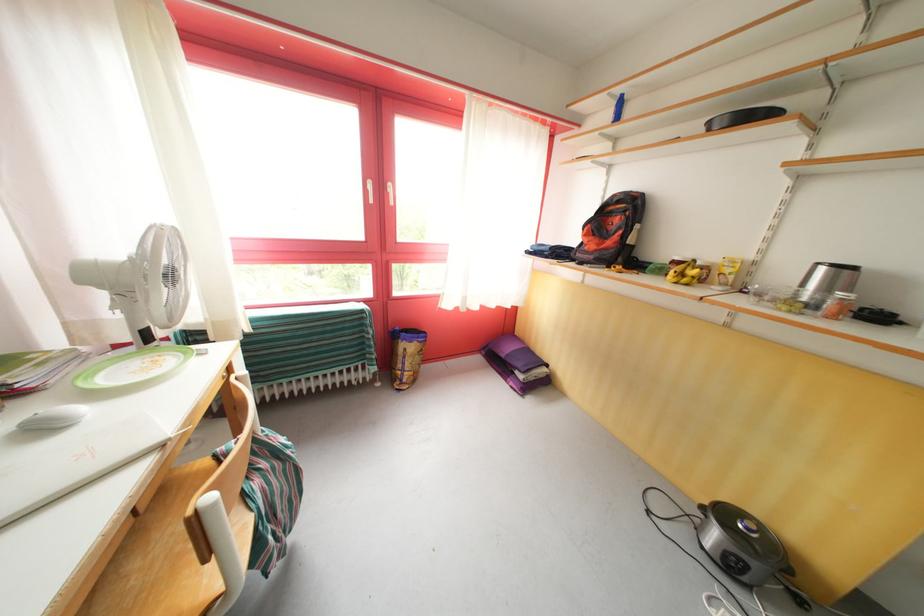
What do you see at coordinates (171, 552) in the screenshot? This screenshot has height=616, width=924. I see `the chair sitting surface` at bounding box center [171, 552].